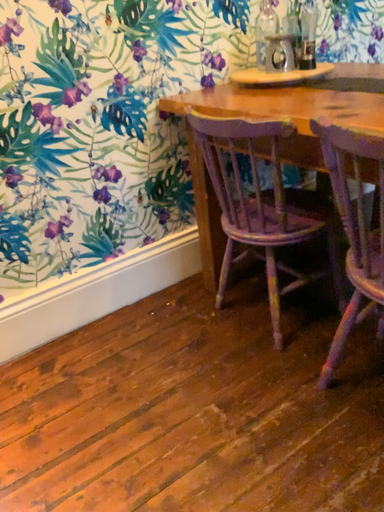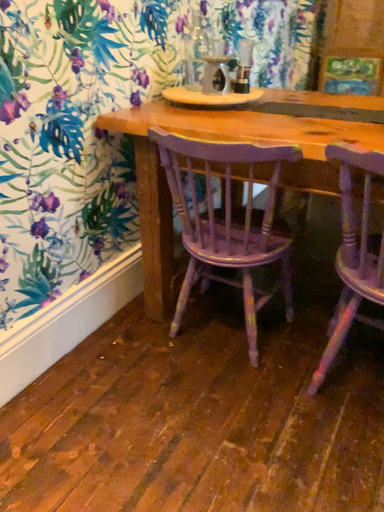
Question: How did the camera likely rotate when shooting the video?

Choices:
 (A) rotated left
 (B) rotated right

Answer: (B)